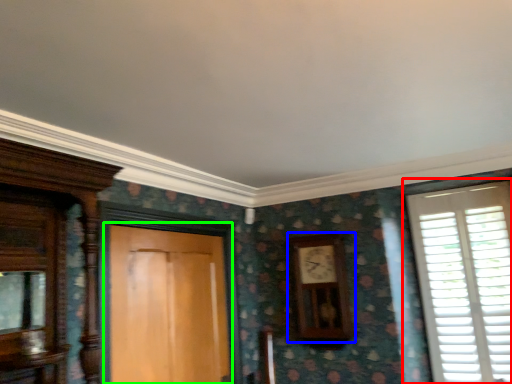
Question: Considering the real-world distances, which object is farthest from window (highlighted by a red box)? clock (highlighted by a blue box) or door (highlighted by a green box)?

Choices:
 (A) clock
 (B) door

Answer: (B)